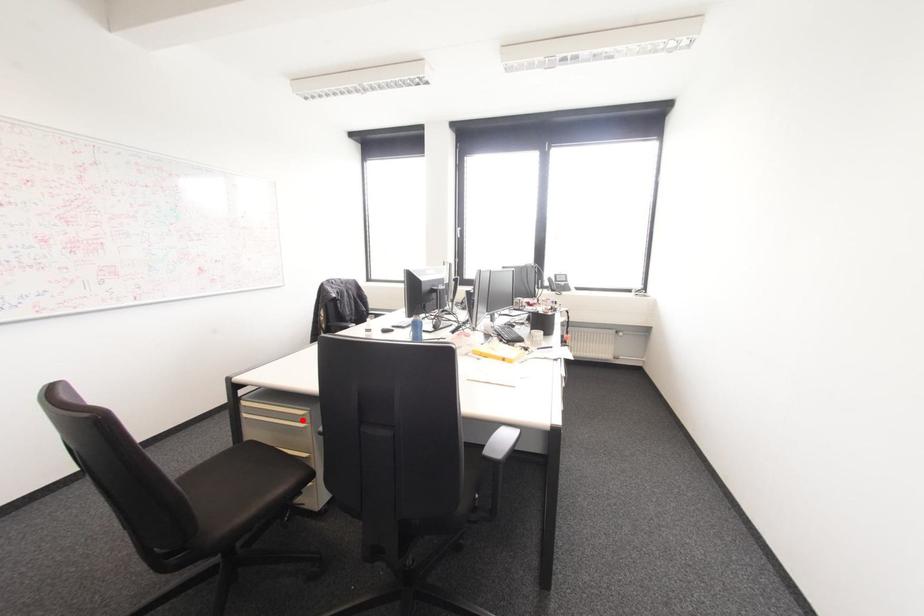
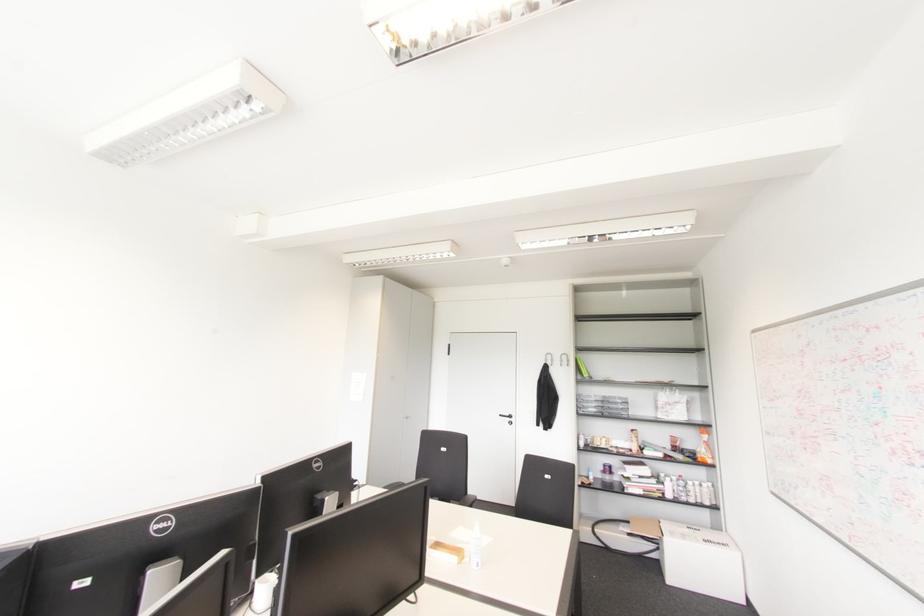
Question: I am providing you with two images of the same scene from different viewpoints. A red point is marked on the first image. Can you still see the location of the red point in image 2?

Choices:
 (A) Yes
 (B) No

Answer: (B)